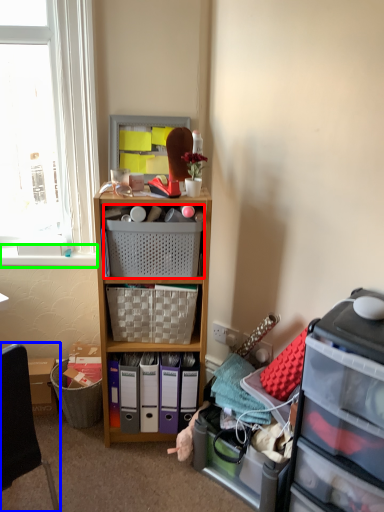
Question: Based on their relative distances, which object is nearer to picnic basket (highlighted by a red box)? Choose from chair (highlighted by a blue box) and window sill (highlighted by a green box).

Choices:
 (A) chair
 (B) window sill

Answer: (B)